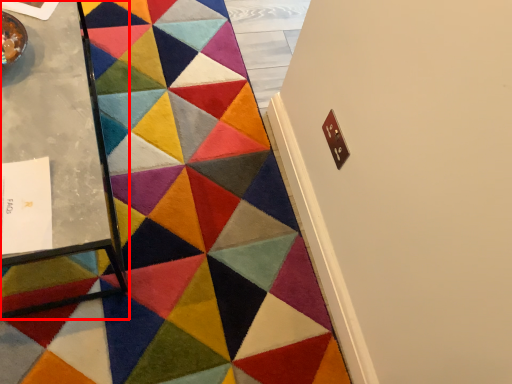
Question: Observing the image, what is the correct spatial positioning of table (annotated by the red box) in reference to mat?

Choices:
 (A) left
 (B) right

Answer: (A)